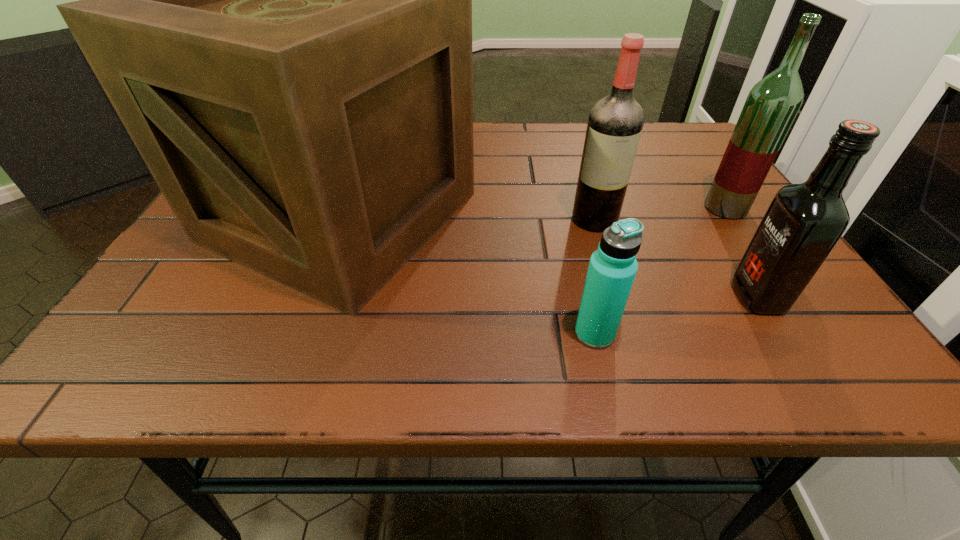
The image size is (960, 540). What are the coordinates of `box` in the screenshot? It's located at pos(277,0).

Where is `the leftmost liquor`? This screenshot has height=540, width=960. the leftmost liquor is located at coordinates (615, 123).

What are the coordinates of `the nearest liquor` in the screenshot? It's located at (803, 223).

The width and height of the screenshot is (960, 540). What are the coordinates of `water bottle` in the screenshot? It's located at (613, 266).

Locate an element on the screen. The height and width of the screenshot is (540, 960). the shortest object is located at coordinates (613, 266).

Locate an element on the screen. The width and height of the screenshot is (960, 540). vacant region located on the front of the leftmost object is located at coordinates (280, 378).

Locate an element on the screen. The image size is (960, 540). free location located 0.300m on the front-facing side of the leftmost liquor is located at coordinates (636, 352).

Locate an element on the screen. This screenshot has width=960, height=540. vacant region located 0.190m on the front-facing side of the nearest liquor is located at coordinates (628, 296).

Identify the location of free point located 0.200m on the front-facing side of the nearest liquor. The image size is (960, 540). (622, 296).

Locate an element on the screen. This screenshot has width=960, height=540. vacant space located 0.100m on the front-facing side of the nearest liquor is located at coordinates [x=679, y=296].